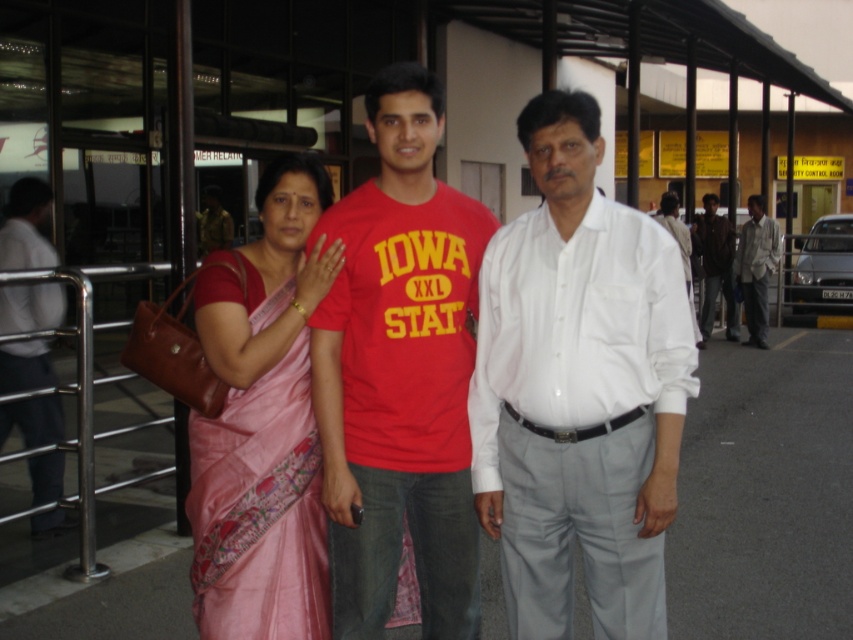
You are a photographer at the scene and want to capture a photo where both the white cotton shirt at center and the dark brown leather jacket at right are visible. Based on their positions, which one should you focus on first to ensure both are in frame?

You should focus on the dark brown leather jacket at right first because the white cotton shirt at center is located below it, so adjusting the camera angle to include the jacket at the top will naturally include the shirt below.